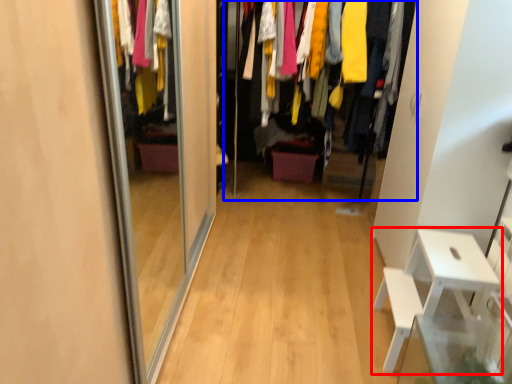
Question: Which object appears closest to the camera in this image, furniture (highlighted by a red box) or closet (highlighted by a blue box)?

Choices:
 (A) furniture
 (B) closet

Answer: (A)